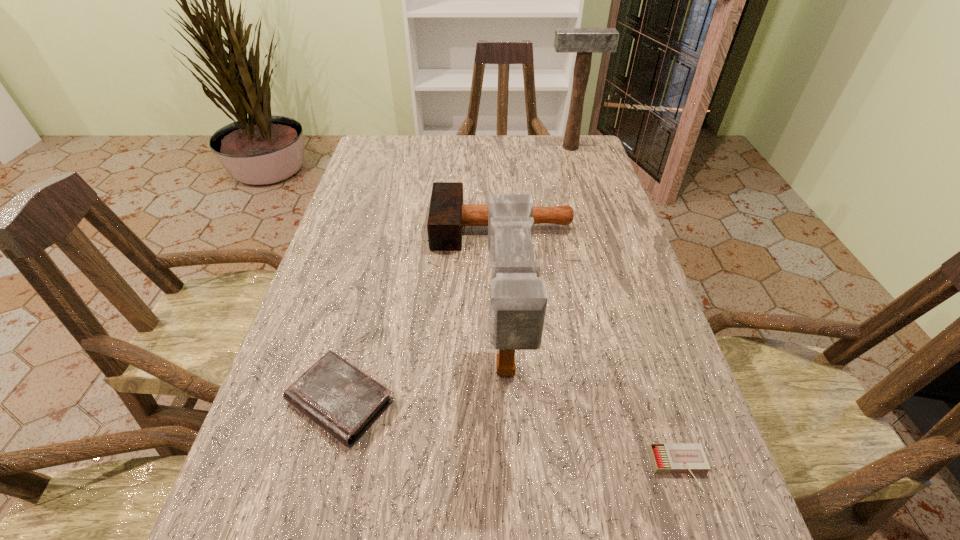
Find the location of a particular element. The height and width of the screenshot is (540, 960). the farthest object is located at coordinates (584, 41).

Where is `the nearest mallet`? the nearest mallet is located at coordinates (518, 300).

At what (x,y) coordinates should I click in order to perform the action: click on the fourth nearest object. Please return your answer as a coordinate pair (x, y). Looking at the image, I should click on (447, 215).

The height and width of the screenshot is (540, 960). Identify the location of the shortest mallet. [x=447, y=215].

Image resolution: width=960 pixels, height=540 pixels. Find the location of `the fourth tallest object`. the fourth tallest object is located at coordinates (337, 396).

The image size is (960, 540). In order to click on the leftmost object in this screenshot , I will do `click(337, 396)`.

Where is `the shortest object`? The width and height of the screenshot is (960, 540). the shortest object is located at coordinates point(669,458).

You are a GUI agent. You are given a task and a screenshot of the screen. Output one action in this format:
    pyautogui.click(x=<x>, y=<y>)
    Task: Click on the free space located on the front of the farthest mallet
    
    Given the screenshot: What is the action you would take?
    pyautogui.click(x=591, y=218)

This screenshot has width=960, height=540. I want to click on vacant space located on the back of the nearest mallet, so click(497, 213).

Locate an element on the screen. The width and height of the screenshot is (960, 540). vacant space located on the hammer head face of the third shortest object is located at coordinates (350, 227).